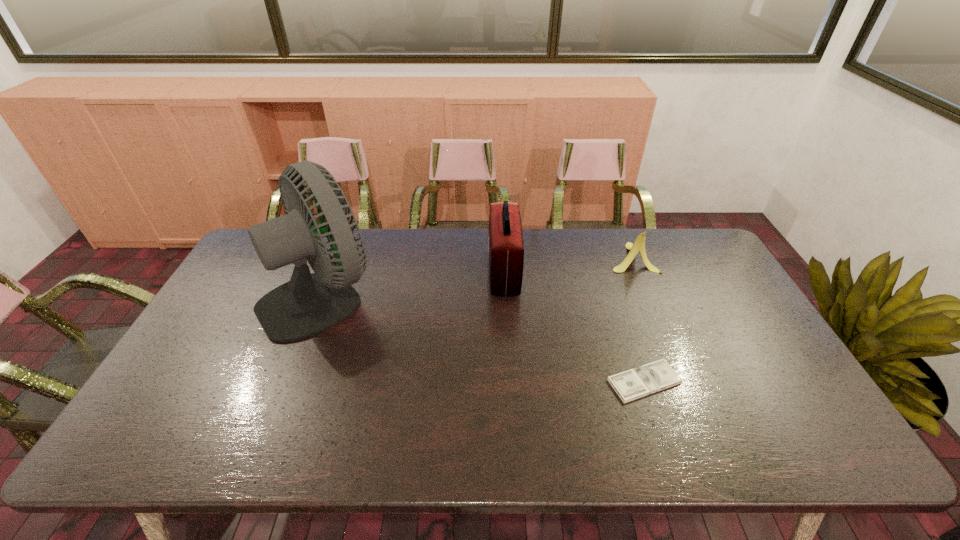
Find the location of a particular element. Image resolution: width=960 pixels, height=540 pixels. the leftmost object is located at coordinates (308, 304).

I want to click on the tallest object, so 308,304.

The image size is (960, 540). I want to click on the first aid kit, so click(506, 247).

In order to click on the third object from right to left in this screenshot , I will do `click(506, 247)`.

This screenshot has width=960, height=540. In order to click on the second shortest object in this screenshot , I will do `click(639, 245)`.

In order to click on the nearest object in this screenshot , I will do `click(632, 384)`.

The width and height of the screenshot is (960, 540). I want to click on the shortest object, so click(632, 384).

Locate an element on the screen. The height and width of the screenshot is (540, 960). vacant point located in front of the tallest object to direct airflow is located at coordinates (498, 297).

The height and width of the screenshot is (540, 960). What are the coordinates of `free spot located 0.100m on the side of the first aid kit with the cross symbol` in the screenshot? It's located at (458, 272).

Where is `free spot located 0.140m on the side of the first aid kit with the cross symbol`? free spot located 0.140m on the side of the first aid kit with the cross symbol is located at coordinates (446, 272).